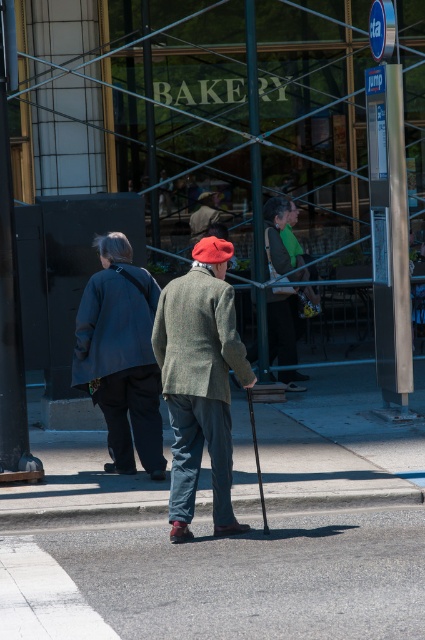
Based on the scene description, what is the 2D coordinate of the gray asphalt at center?

The 2D coordinate of the gray asphalt at center is at point (243, 579).

You are a delivery person trying to park your bike between the gray asphalt at center and the dark gray wool coat at center. Can you fit your bike there if your bike is 1 meter wide?

The gray asphalt at center is wider than the dark gray wool coat at center. Since the bike is 1 meter wide, it depends on the available space between them. However, the description only states the asphalt is wider, but does not provide exact measurements. Without specific dimensions, it is uncertain if the bike will fit.

You are standing at the point labeled point (269, 301) and want to walk to the point labeled point (201, 196). Based on the scene, which direction should you move to get closer to your destination?

Since point (269, 301) is closer to the camera than point (201, 196), you should move away from the camera to reach your destination.